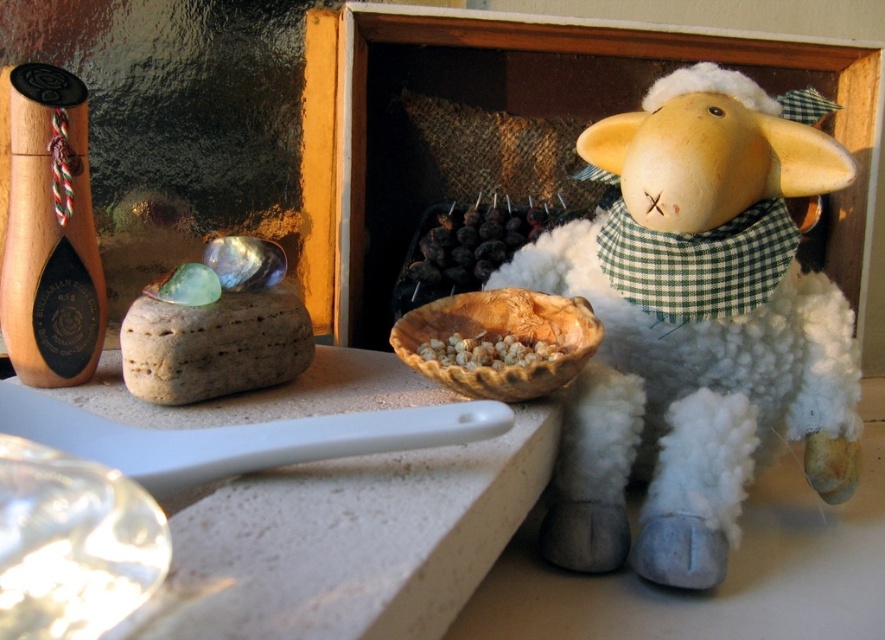
Does white plush sheep at right have a larger size compared to brown grainy bowl at center?

Correct, white plush sheep at right is larger in size than brown grainy bowl at center.

Who is lower down, white plush sheep at right or brown grainy bowl at center?

brown grainy bowl at center is below.

You are a GUI agent. You are given a task and a screenshot of the screen. Output one action in this format:
    pyautogui.click(x=<x>, y=<y>)
    Task: Click on the white plush sheep at right
    This screenshot has width=885, height=640.
    Given the screenshot: What is the action you would take?
    pyautogui.click(x=695, y=326)

This screenshot has height=640, width=885. What do you see at coordinates (466, 244) in the screenshot? I see `dark purple grapes at center` at bounding box center [466, 244].

Who is shorter, dark purple grapes at center or brown grainy bowl at center?

Standing shorter between the two is brown grainy bowl at center.

The image size is (885, 640). What are the coordinates of `dark purple grapes at center` in the screenshot? It's located at (466, 244).

Which is in front, point (189, 397) or point (455, 253)?

Point (189, 397) is more forward.

Does point (287, 289) come behind point (429, 273)?

That is False.

This screenshot has width=885, height=640. Identify the location of brown textured rock at left. (214, 346).